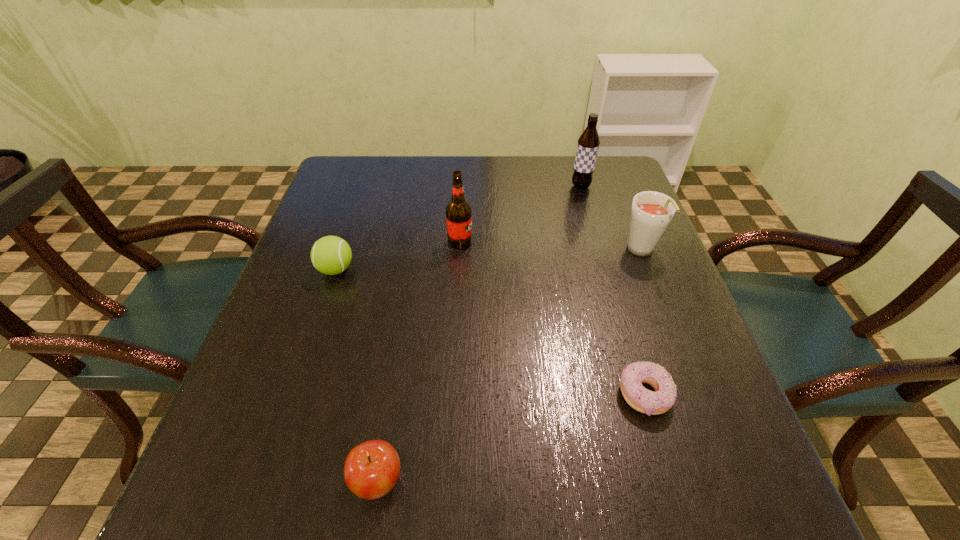
This screenshot has height=540, width=960. Identify the location of free location that satisfies the following two spatial constraints: 1. on the back side of the leftmost root beer; 2. on the right side of the tennis ball. (345, 242).